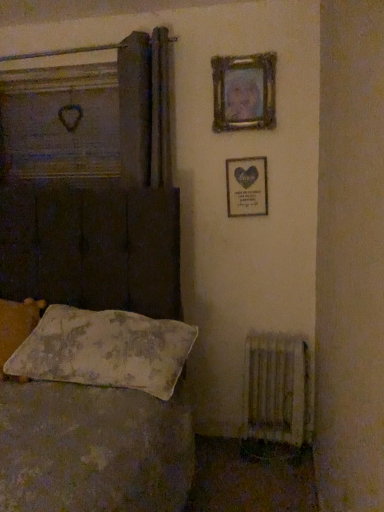
Image resolution: width=384 pixels, height=512 pixels. Identify the location of fluffy white pillow at lower left, which ranks as the second pillow in right-to-left order. (16, 326).

Describe the element at coordinates (276, 388) in the screenshot. I see `white textured radiator at lower right` at that location.

The height and width of the screenshot is (512, 384). What are the coordinates of `fluffy white pillow at lower left, placed as the first pillow when sorted from left to right` in the screenshot? It's located at (16, 326).

Choose the correct answer: Is fluffy white pillow at lower left, which ranks as the second pillow in right-to-left order, inside wooden frame with heart at upper right, acting as the first picture frame starting from the bottom, or outside it?

fluffy white pillow at lower left, which ranks as the second pillow in right-to-left order, is spatially situated outside wooden frame with heart at upper right, acting as the first picture frame starting from the bottom.

From the image's perspective, which pillow is the 1st one below the wooden frame with heart at upper right, positioned as the second picture frame in top-to-bottom order? Please provide its 2D coordinates.

[(16, 326)]

Based on the photo, is fluffy white pillow at lower left, placed as the first pillow when sorted from left to right, bigger or smaller than wooden frame with heart at upper right, positioned as the second picture frame in top-to-bottom order?

Considering their sizes, fluffy white pillow at lower left, placed as the first pillow when sorted from left to right, takes up more space than wooden frame with heart at upper right, positioned as the second picture frame in top-to-bottom order.

Is fluffy white pillow at lower left, which ranks as the second pillow in right-to-left order, oriented towards wooden frame with heart at upper right, acting as the first picture frame starting from the bottom?

No.

Is point (13, 340) farther from viewer compared to point (262, 426)?

No.

Which is more to the right, fluffy white pillow at lower left, which ranks as the second pillow in right-to-left order, or white textured radiator at lower right?

From the viewer's perspective, white textured radiator at lower right appears more on the right side.

Between fluffy white pillow at lower left, placed as the first pillow when sorted from left to right, and white textured radiator at lower right, which one has more height?

With more height is white textured radiator at lower right.

Could you tell me if white textured radiator at lower right is turned towards fluffy white pillow at lower left, placed as the first pillow when sorted from left to right?

No, white textured radiator at lower right is not aimed at fluffy white pillow at lower left, placed as the first pillow when sorted from left to right.

Is white textured radiator at lower right surrounding fluffy white pillow at lower left, which ranks as the second pillow in right-to-left order?

No, fluffy white pillow at lower left, which ranks as the second pillow in right-to-left order, is not a part of white textured radiator at lower right.

Identify the location of pillow that is the 2nd object located above the white textured radiator at lower right (from the image's perspective). (16, 326).

Between wooden frame with heart at upper right, positioned as the second picture frame in top-to-bottom order, and fluffy white pillow at lower left, which ranks as the second pillow in right-to-left order, which one has smaller size?

wooden frame with heart at upper right, positioned as the second picture frame in top-to-bottom order, is smaller.

How distant is wooden frame with heart at upper right, positioned as the second picture frame in top-to-bottom order, from fluffy white pillow at lower left, which ranks as the second pillow in right-to-left order?

wooden frame with heart at upper right, positioned as the second picture frame in top-to-bottom order, and fluffy white pillow at lower left, which ranks as the second pillow in right-to-left order, are 3.88 feet apart.

From the image's perspective, which one is positioned lower, wooden frame with heart at upper right, positioned as the second picture frame in top-to-bottom order, or fluffy white pillow at lower left, placed as the first pillow when sorted from left to right?

fluffy white pillow at lower left, placed as the first pillow when sorted from left to right, from the image's perspective.

Is wooden frame with heart at upper right, positioned as the second picture frame in top-to-bottom order, positioned with its back to fluffy white pillow at lower left, which ranks as the second pillow in right-to-left order?

That's not correct — wooden frame with heart at upper right, positioned as the second picture frame in top-to-bottom order, is not looking away from fluffy white pillow at lower left, which ranks as the second pillow in right-to-left order.

Who is shorter, white textured radiator at lower right or wooden frame with heart at upper right, acting as the first picture frame starting from the bottom?

wooden frame with heart at upper right, acting as the first picture frame starting from the bottom, is shorter.

Is white textured radiator at lower right turned away from wooden frame with heart at upper right, acting as the first picture frame starting from the bottom?

No, white textured radiator at lower right is not facing the opposite direction of wooden frame with heart at upper right, acting as the first picture frame starting from the bottom.

Is wooden frame at upper right, positioned as the second picture frame in bottom-to-top order, oriented away from white textured radiator at lower right?

No.

Consider the image. Is wooden frame at upper right, positioned as the second picture frame in bottom-to-top order, closer to the viewer compared to white textured radiator at lower right?

No.

Does wooden frame at upper right, arranged as the first picture frame when viewed from the top, have a smaller size compared to white textured radiator at lower right?

Yes.

Locate an element on the screen. This screenshot has height=512, width=384. radiator on the right of wooden frame at upper right, positioned as the second picture frame in bottom-to-top order is located at coordinates (276, 388).

Would you say floral fabric pillow at lower left, which is the 2th pillow from left to right, is a long distance from fluffy white pillow at lower left, placed as the first pillow when sorted from left to right?

No.

Is point (60, 374) positioned behind point (7, 340)?

No, it is not.

Can you confirm if floral fabric pillow at lower left, which is the 2th pillow from left to right, is shorter than fluffy white pillow at lower left, which ranks as the second pillow in right-to-left order?

Indeed, floral fabric pillow at lower left, which is the 2th pillow from left to right, has a lesser height compared to fluffy white pillow at lower left, which ranks as the second pillow in right-to-left order.

From the wooden frame with heart at upper right, positioned as the second picture frame in top-to-bottom order, count 1st pillows forward and point to it. Please provide its 2D coordinates.

[(16, 326)]

From a real-world perspective, starting from the white textured radiator at lower right, which pillow is the 2nd one vertically above it? Please provide its 2D coordinates.

[(16, 326)]

When comparing their distances from wooden frame with heart at upper right, acting as the first picture frame starting from the bottom, does wooden frame at upper right, positioned as the second picture frame in bottom-to-top order, or white textured radiator at lower right seem closer?

The object closer to wooden frame with heart at upper right, acting as the first picture frame starting from the bottom, is wooden frame at upper right, positioned as the second picture frame in bottom-to-top order.

Considering their positions, is white textured radiator at lower right positioned closer to fluffy white pillow at lower left, which ranks as the second pillow in right-to-left order, than wooden frame at upper right, arranged as the first picture frame when viewed from the top?

white textured radiator at lower right lies closer to fluffy white pillow at lower left, which ranks as the second pillow in right-to-left order, than the other object.

Consider the image. Based on their spatial positions, is wooden frame with heart at upper right, positioned as the second picture frame in top-to-bottom order, or floral fabric pillow at lower left, which is the 2th pillow from left to right, closer to fluffy white pillow at lower left, placed as the first pillow when sorted from left to right?

floral fabric pillow at lower left, which is the 2th pillow from left to right.

From the image, which object appears to be nearer to fluffy white pillow at lower left, placed as the first pillow when sorted from left to right, white textured radiator at lower right or wooden frame with heart at upper right, positioned as the second picture frame in top-to-bottom order?

wooden frame with heart at upper right, positioned as the second picture frame in top-to-bottom order, lies closer to fluffy white pillow at lower left, placed as the first pillow when sorted from left to right, than the other object.

When comparing their distances from fluffy white pillow at lower left, placed as the first pillow when sorted from left to right, does wooden frame at upper right, positioned as the second picture frame in bottom-to-top order, or floral fabric pillow at lower left, which is the 2th pillow from left to right, seem closer?

floral fabric pillow at lower left, which is the 2th pillow from left to right.

Considering their positions, is floral fabric pillow at lower left, which is the 2th pillow from left to right, positioned closer to fluffy white pillow at lower left, which ranks as the second pillow in right-to-left order, than wooden frame at upper right, arranged as the first picture frame when viewed from the top?

Based on the image, floral fabric pillow at lower left, which is the 2th pillow from left to right, appears to be nearer to fluffy white pillow at lower left, which ranks as the second pillow in right-to-left order.

Which object lies further to the anchor point wooden frame at upper right, arranged as the first picture frame when viewed from the top, floral fabric pillow at lower left, which is the 2th pillow from left to right, or fluffy white pillow at lower left, placed as the first pillow when sorted from left to right?

Based on the image, fluffy white pillow at lower left, placed as the first pillow when sorted from left to right, appears to be further to wooden frame at upper right, arranged as the first picture frame when viewed from the top.

Considering their positions, is floral fabric pillow at lower left, which is the 2th pillow from left to right, positioned further to wooden frame at upper right, positioned as the second picture frame in bottom-to-top order, than white textured radiator at lower right?

white textured radiator at lower right is positioned further to the anchor wooden frame at upper right, positioned as the second picture frame in bottom-to-top order.

Find the location of a particular element. This screenshot has width=384, height=512. pillow located between fluffy white pillow at lower left, placed as the first pillow when sorted from left to right, and white textured radiator at lower right in the left-right direction is located at coordinates (105, 350).

The image size is (384, 512). I want to click on picture frame between wooden frame at upper right, arranged as the first picture frame when viewed from the top, and floral fabric pillow at lower left, which is the 2th pillow from left to right, in the up-down direction, so click(247, 187).

I want to click on picture frame between fluffy white pillow at lower left, placed as the first pillow when sorted from left to right, and wooden frame with heart at upper right, acting as the first picture frame starting from the bottom, from left to right, so click(244, 92).

Where is `picture frame between wooden frame at upper right, positioned as the second picture frame in bottom-to-top order, and white textured radiator at lower right in the up-down direction`? Image resolution: width=384 pixels, height=512 pixels. picture frame between wooden frame at upper right, positioned as the second picture frame in bottom-to-top order, and white textured radiator at lower right in the up-down direction is located at coordinates (247, 187).